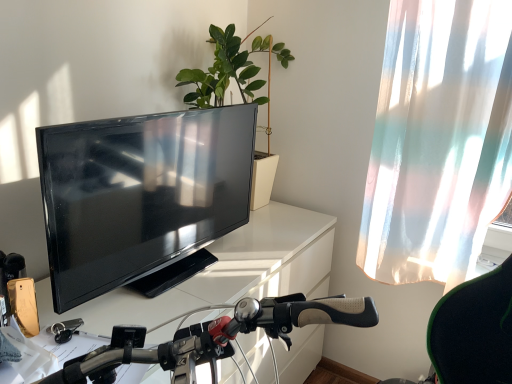
Question: Visually, is matte black tv at left positioned to the left or to the right of green matte plant at upper center?

Choices:
 (A) left
 (B) right

Answer: (A)

Question: From the image's perspective, is matte black tv at left positioned above or below green matte plant at upper center?

Choices:
 (A) below
 (B) above

Answer: (A)

Question: Which object is the closest to the matte black tv at left?

Choices:
 (A) white glossy desk at center
 (B) green matte plant at upper center
 (C) translucent fabric curtain at right

Answer: (A)

Question: Which object is positioned farthest from the translucent fabric curtain at right?

Choices:
 (A) green matte plant at upper center
 (B) white glossy desk at center
 (C) matte black tv at left

Answer: (C)